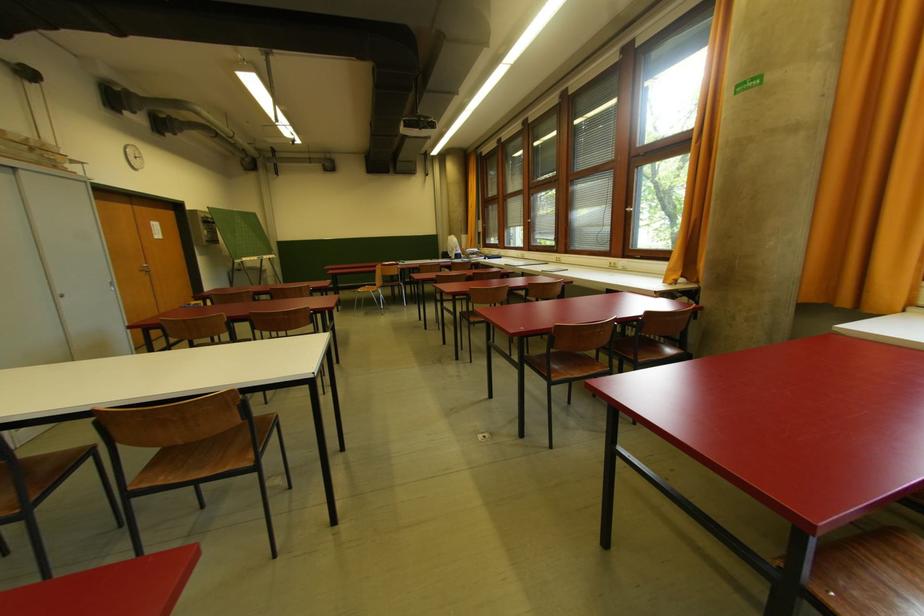
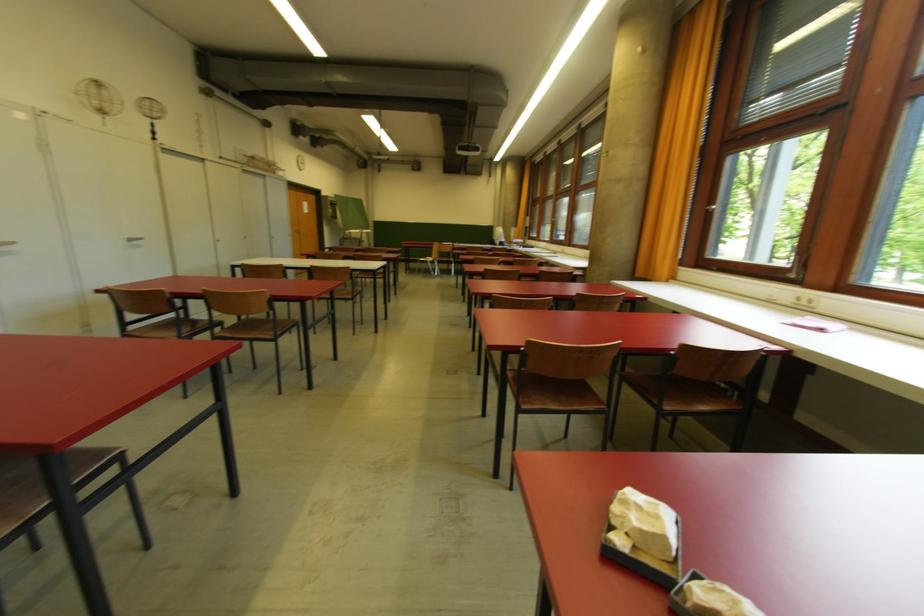
In a continuous first-person perspective shot, in which direction is the camera moving?

The movement direction of the cameraman is right, backward.